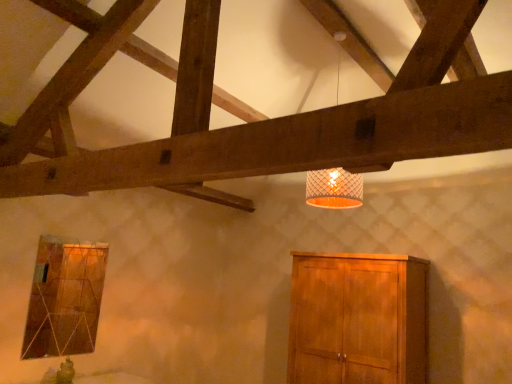
Question: From the image's perspective, would you say white mesh lampshade at upper center is shown under wooden cabinet at lower right?

Choices:
 (A) yes
 (B) no

Answer: (B)

Question: Is white mesh lampshade at upper center positioned behind wooden cabinet at lower right?

Choices:
 (A) no
 (B) yes

Answer: (A)

Question: Is white mesh lampshade at upper center located outside wooden cabinet at lower right?

Choices:
 (A) yes
 (B) no

Answer: (A)

Question: Does white mesh lampshade at upper center have a lesser width compared to wooden cabinet at lower right?

Choices:
 (A) no
 (B) yes

Answer: (B)

Question: Does white mesh lampshade at upper center have a smaller size compared to wooden cabinet at lower right?

Choices:
 (A) no
 (B) yes

Answer: (B)

Question: Is white mesh lampshade at upper center aimed at wooden cabinet at lower right?

Choices:
 (A) yes
 (B) no

Answer: (B)

Question: Can you confirm if white mesh lampshade at upper center is wider than matte glass window at lower left?

Choices:
 (A) yes
 (B) no

Answer: (A)

Question: Is white mesh lampshade at upper center far from matte glass window at lower left?

Choices:
 (A) no
 (B) yes

Answer: (B)

Question: Is white mesh lampshade at upper center not within matte glass window at lower left?

Choices:
 (A) no
 (B) yes

Answer: (B)

Question: Can you confirm if white mesh lampshade at upper center is shorter than matte glass window at lower left?

Choices:
 (A) yes
 (B) no

Answer: (B)

Question: From a real-world perspective, does white mesh lampshade at upper center stand above matte glass window at lower left?

Choices:
 (A) no
 (B) yes

Answer: (B)

Question: Considering the relative sizes of white mesh lampshade at upper center and matte glass window at lower left in the image provided, is white mesh lampshade at upper center taller than matte glass window at lower left?

Choices:
 (A) yes
 (B) no

Answer: (A)

Question: Can you confirm if matte glass window at lower left is shorter than wooden cabinet at lower right?

Choices:
 (A) yes
 (B) no

Answer: (A)